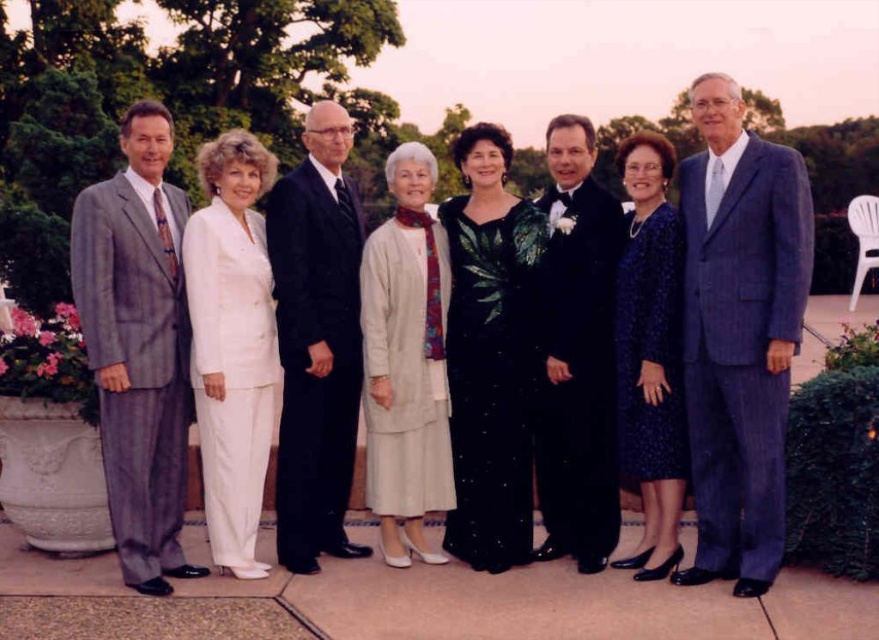
In the scene shown: Between matte gray suit at left and gray wool suit at left, which one appears on the left side from the viewer's perspective?

Positioned to the left is gray wool suit at left.

Is point (489, 163) positioned in front of point (166, 134)?

No, (489, 163) is further to viewer.

Locate an element on the screen. Image resolution: width=879 pixels, height=640 pixels. matte gray suit at left is located at coordinates (694, 336).

Can you confirm if white satin suit at center is thinner than dark blue textured dress at center?

No.

How far apart are white satin suit at center and dark blue textured dress at center?

A distance of 2.07 meters exists between white satin suit at center and dark blue textured dress at center.

Between point (222, 500) and point (656, 433), which one is positioned in front?

Positioned in front is point (222, 500).

Locate an element on the screen. This screenshot has width=879, height=640. white satin suit at center is located at coordinates (231, 342).

Does blue pinstripe suit at right have a greater width compared to white satin suit at center?

Correct, the width of blue pinstripe suit at right exceeds that of white satin suit at center.

Is blue pinstripe suit at right shorter than white satin suit at center?

Incorrect, blue pinstripe suit at right's height does not fall short of white satin suit at center's.

The height and width of the screenshot is (640, 879). I want to click on blue pinstripe suit at right, so click(739, 333).

Locate an element on the screen. blue pinstripe suit at right is located at coordinates (739, 333).